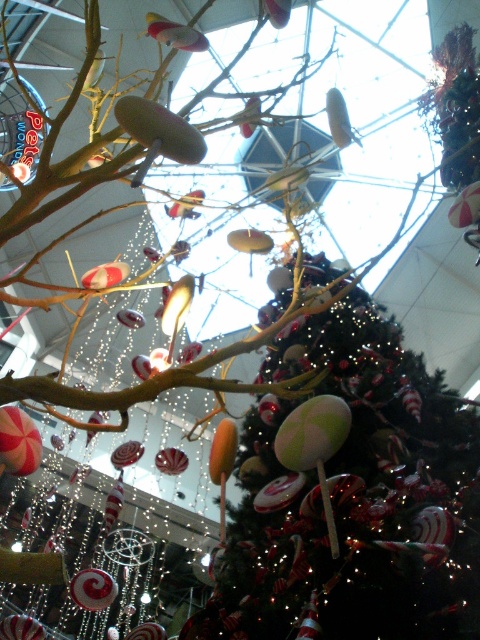
You are a maintenance worker in the mall and need to reach both the shiny green ball at center and the shiny red lollipop at lower left. The ladder you have can extend up to 5 meters. Can you safely reach both decorations with the ladder you have?

The shiny green ball at center is 5.88 meters away from the shiny red lollipop at lower left. Since the ladder can only extend up to 5 meters, you cannot safely reach both decorations as the distance between them exceeds the ladder height capacity.

From the picture: You are a visitor at the Christmas market and want to take a photo of both the shiny green ball at center and the shiny red lollipop at lower left without any obstruction. Based on their positions, which object should you focus on first to ensure both are in frame?

The shiny green ball at center is positioned over the shiny red lollipop at lower left, so you should focus on the shiny red lollipop at lower left first to ensure both are visible in the photo.